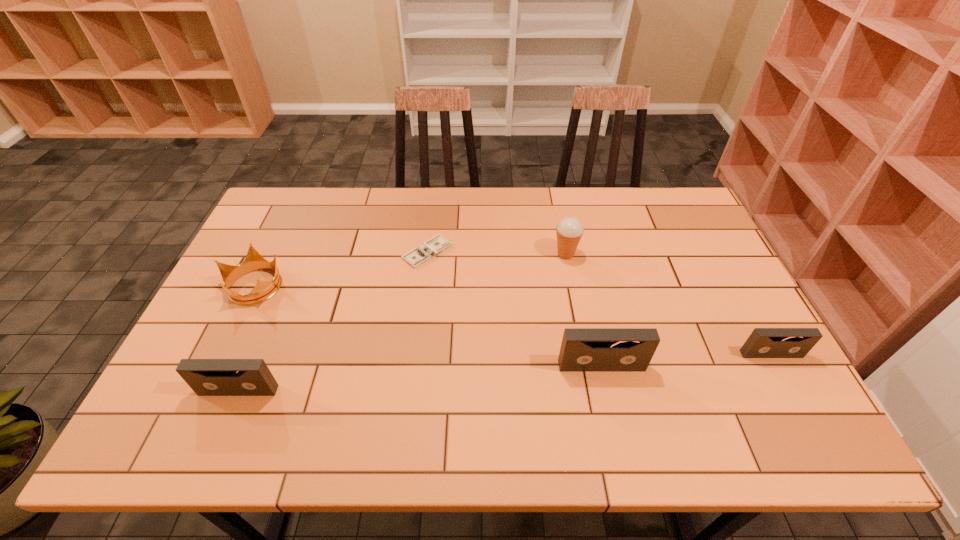
Locate an element on the screen. vacant space at the left edge is located at coordinates (238, 265).

The width and height of the screenshot is (960, 540). In the image, there is a desktop. In order to click on vacant space at the right edge in this screenshot , I will do (x=750, y=328).

This screenshot has height=540, width=960. I want to click on free space at the far left corner, so click(x=310, y=206).

Where is `free space that is in between the farthest videotape and the icecream`? The image size is (960, 540). free space that is in between the farthest videotape and the icecream is located at coordinates (668, 304).

Locate an element on the screen. The image size is (960, 540). free area in between the nearest videotape and the crown is located at coordinates (247, 338).

At what (x,y) coordinates should I click in order to perform the action: click on empty space that is in between the icecream and the third object from left to right. Please return your answer as a coordinate pair (x, y). This screenshot has height=540, width=960. Looking at the image, I should click on (496, 253).

Identify the location of vacant region between the crown and the dollar. This screenshot has height=540, width=960. (341, 269).

Find the location of a particular element. vacant area between the shortest object and the icecream is located at coordinates (496, 253).

This screenshot has width=960, height=540. I want to click on free spot between the third nearest object and the shortest object, so click(x=599, y=303).

Where is `unoccupied area between the crown and the second tallest videotape`? This screenshot has height=540, width=960. unoccupied area between the crown and the second tallest videotape is located at coordinates (247, 338).